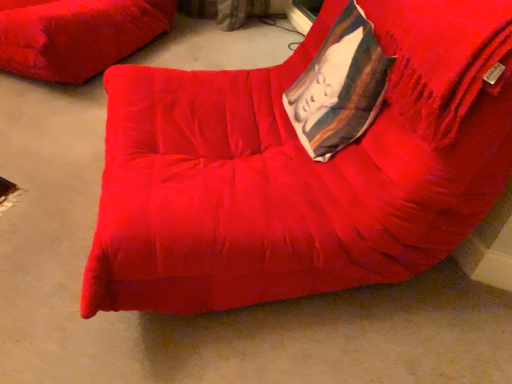
Question: Is velvet-like white pillow at upper right wider or thinner than velvet red bean bag chair at center, the 2th furniture in the back-to-front sequence?

Choices:
 (A) wide
 (B) thin

Answer: (B)

Question: From the image's perspective, is velvet-like white pillow at upper right positioned above or below velvet red bean bag chair at center, marked as the 2th furniture in a left-to-right arrangement?

Choices:
 (A) above
 (B) below

Answer: (A)

Question: Which object is the farthest from the velvet-like white pillow at upper right?

Choices:
 (A) velvet red bean bag chair at center, which is counted as the 1th furniture, starting from the right
 (B) velvet red cushion at upper left, which appears as the 2th furniture when viewed from the front

Answer: (B)

Question: Based on their relative distances, which object is nearer to the velvet red cushion at upper left, arranged as the 1th furniture when viewed from the back?

Choices:
 (A) velvet-like white pillow at upper right
 (B) velvet red bean bag chair at center, the 2th furniture in the back-to-front sequence

Answer: (B)